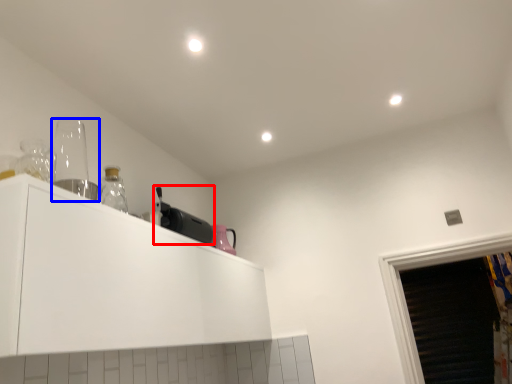
Question: Which object appears closest to the camera in this image, appliance (highlighted by a red box) or appliance (highlighted by a blue box)?

Choices:
 (A) appliance
 (B) appliance

Answer: (B)